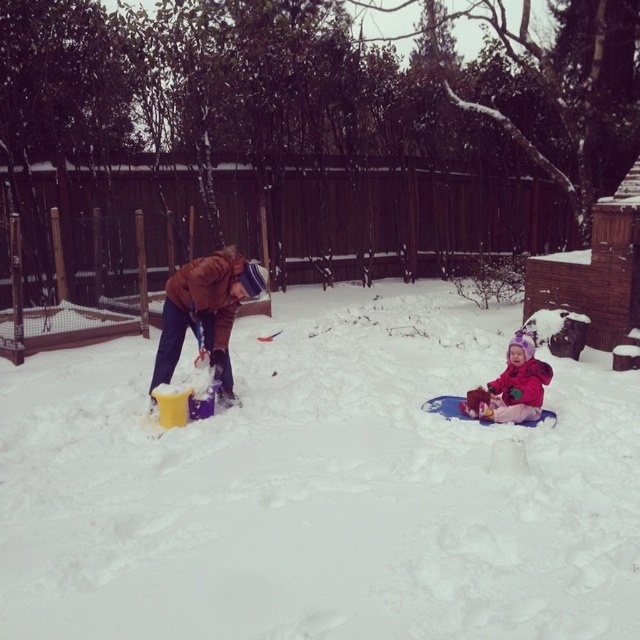
Question: Which of the following is the closest to the observer?

Choices:
 (A) brown leather jacket at center
 (B) fluffy pink snowsuit at lower right

Answer: (A)

Question: Which object is the closest to the fluffy pink snowsuit at lower right?

Choices:
 (A) white fluffy snow at center
 (B) brown leather jacket at center

Answer: (A)

Question: Does white fluffy snow at center have a lesser width compared to fluffy pink snowsuit at lower right?

Choices:
 (A) yes
 (B) no

Answer: (B)

Question: Is white fluffy snow at center above fluffy pink snowsuit at lower right?

Choices:
 (A) no
 (B) yes

Answer: (A)

Question: Which of the following is the farthest from the observer?

Choices:
 (A) (520, 417)
 (B) (349, 420)
 (C) (176, 308)

Answer: (B)

Question: Can you confirm if brown leather jacket at center is positioned to the right of fluffy pink snowsuit at lower right?

Choices:
 (A) yes
 (B) no

Answer: (B)